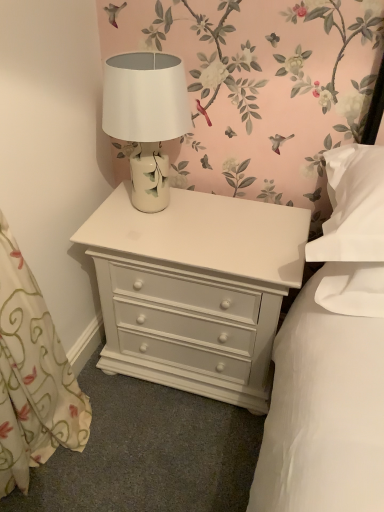
Question: Are white painted wood nightstand at center and white ceramic table lamp at center far apart?

Choices:
 (A) no
 (B) yes

Answer: (A)

Question: Is white painted wood nightstand at center wider than white ceramic table lamp at center?

Choices:
 (A) yes
 (B) no

Answer: (A)

Question: Is white painted wood nightstand at center aimed at white ceramic table lamp at center?

Choices:
 (A) no
 (B) yes

Answer: (A)

Question: Does white painted wood nightstand at center have a lesser width compared to white ceramic table lamp at center?

Choices:
 (A) yes
 (B) no

Answer: (B)

Question: From a real-world perspective, is white painted wood nightstand at center positioned over white ceramic table lamp at center based on gravity?

Choices:
 (A) no
 (B) yes

Answer: (A)

Question: Is white ceramic table lamp at center a part of white painted wood nightstand at center?

Choices:
 (A) no
 (B) yes

Answer: (A)

Question: Considering the relative sizes of white ceramic table lamp at center and white painted wood nightstand at center in the image provided, is white ceramic table lamp at center taller than white painted wood nightstand at center?

Choices:
 (A) yes
 (B) no

Answer: (B)

Question: Considering the relative sizes of white ceramic table lamp at center and white painted wood nightstand at center in the image provided, is white ceramic table lamp at center bigger than white painted wood nightstand at center?

Choices:
 (A) yes
 (B) no

Answer: (B)

Question: Is white ceramic table lamp at center surrounding white painted wood nightstand at center?

Choices:
 (A) yes
 (B) no

Answer: (B)

Question: Considering the relative positions of white ceramic table lamp at center and white painted wood nightstand at center in the image provided, is white ceramic table lamp at center to the left of white painted wood nightstand at center from the viewer's perspective?

Choices:
 (A) yes
 (B) no

Answer: (A)

Question: Is white ceramic table lamp at center smaller than white painted wood nightstand at center?

Choices:
 (A) no
 (B) yes

Answer: (B)

Question: Can you confirm if white ceramic table lamp at center is wider than white painted wood nightstand at center?

Choices:
 (A) yes
 (B) no

Answer: (B)

Question: Considering the relative positions of white ceramic table lamp at center and white painted wood nightstand at center in the image provided, is white ceramic table lamp at center to the left or to the right of white painted wood nightstand at center?

Choices:
 (A) right
 (B) left

Answer: (B)